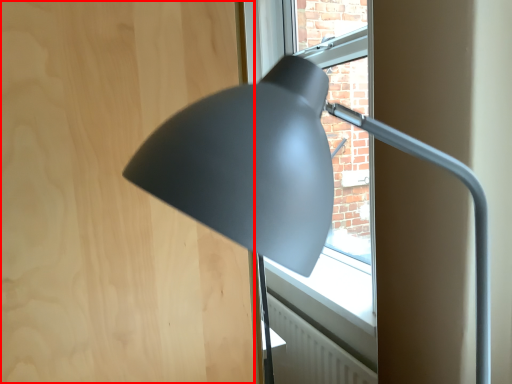
Question: From the image, what is the correct spatial relationship of plywood (annotated by the red box) in relation to lamp?

Choices:
 (A) left
 (B) right

Answer: (A)